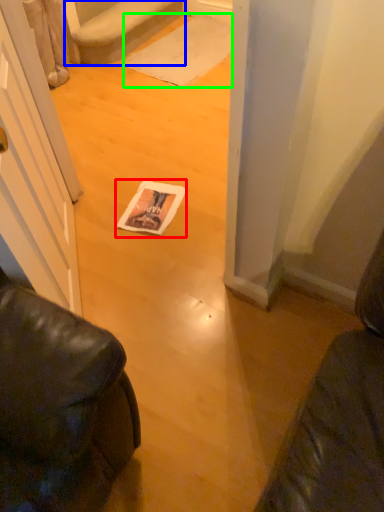
Question: Estimate the real-world distances between objects in this image. Which object is closer to magazine (highlighted by a red box), stairwell (highlighted by a blue box) or doormat (highlighted by a green box)?

Choices:
 (A) stairwell
 (B) doormat

Answer: (B)